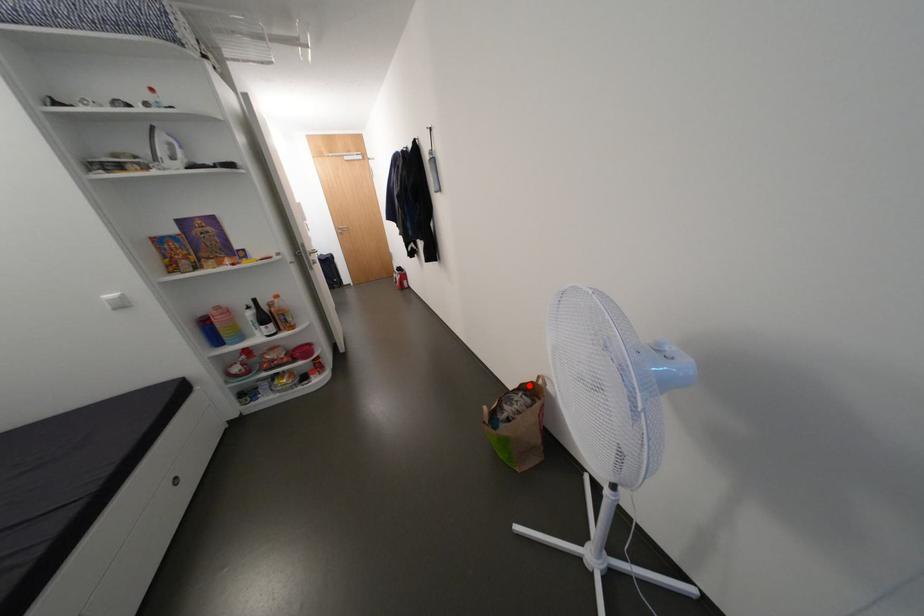
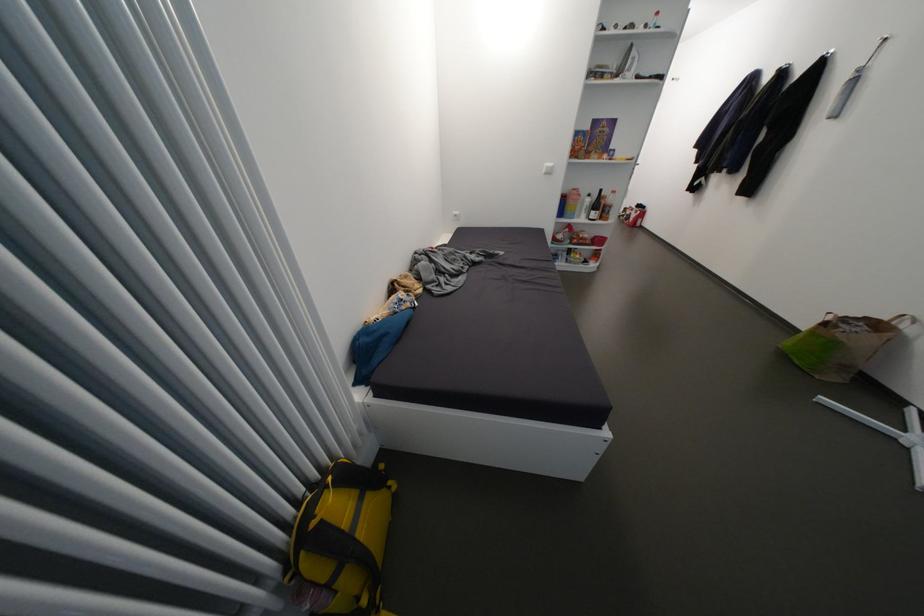
Locate, in the second image, the point that corresponds to the highlighted location in the first image.

(872, 318)